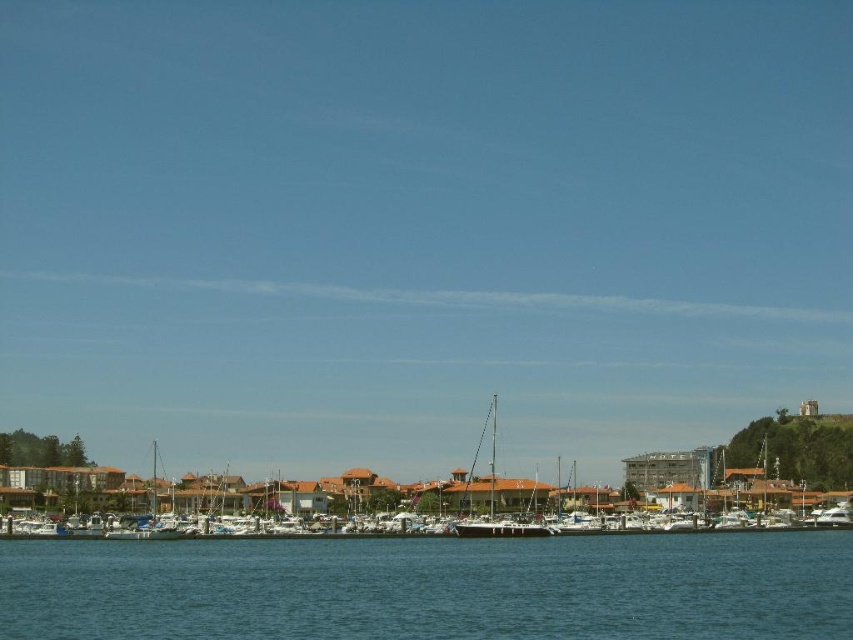
You are standing at the edge of the marina and want to determine which of the two points, point [294,593] or point [494,428], is closer to you. Based on the scene, which point is nearer?

Point [294,593] is closer to the viewer than point [494,428].

You are a photographer planning to capture the white matte boats at center and the clear blue water at lower center in a single shot. Based on their positions, which object will appear closer to the bottom of the photo?

The clear blue water at lower center will appear closer to the bottom of the photo since it is shorter than the white matte boats at center, meaning it occupies a lower position in the image.

You are standing on the dock and see the clear blue water at lower center and the white glossy sailboat at center. Which object is taller from your viewpoint?

The white glossy sailboat at center is taller than the clear blue water at lower center.